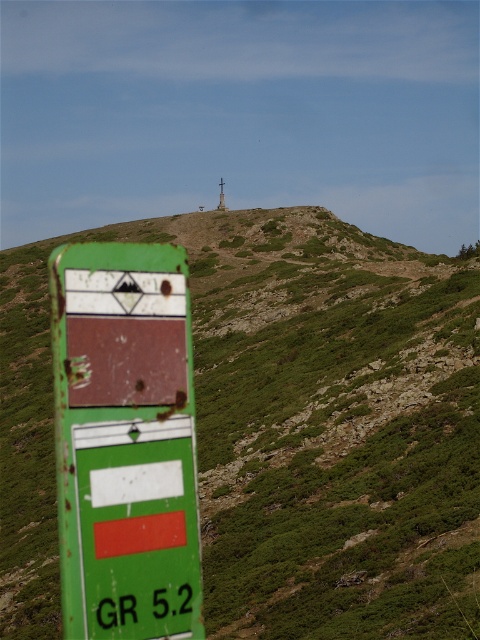
Who is more forward, (356, 417) or (142, 404)?

Positioned in front is point (142, 404).

Does green grassy hillside at upper center appear on the left side of rusty green sign at left?

Yes, green grassy hillside at upper center is to the left of rusty green sign at left.

Locate an element on the screen. green grassy hillside at upper center is located at coordinates (285, 429).